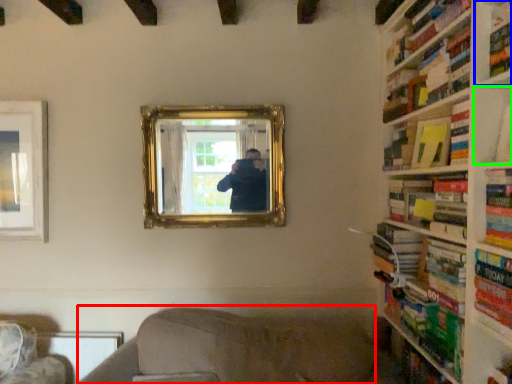
Question: Which object is the closest to the couch (highlighted by a red box)? Choose among these: shelf (highlighted by a blue box) or shelf (highlighted by a green box).

Choices:
 (A) shelf
 (B) shelf

Answer: (B)